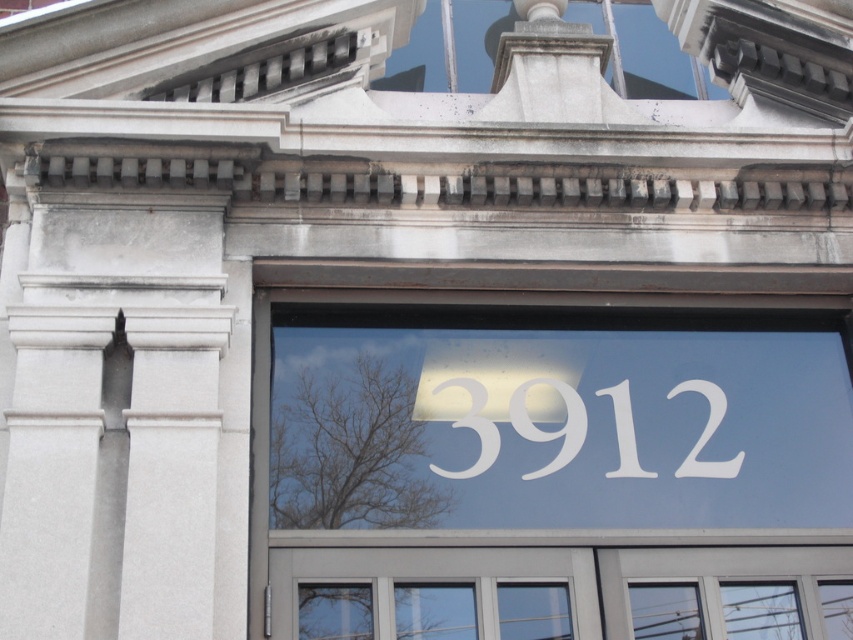
Question: Which point is farther to the camera?

Choices:
 (A) (265, 579)
 (B) (709, 474)

Answer: (B)

Question: Can you confirm if white vinyl numbers at center is positioned to the left of white matte number at center?

Choices:
 (A) yes
 (B) no

Answer: (A)

Question: Which point is closer to the camera?

Choices:
 (A) (791, 372)
 (B) (561, 403)

Answer: (B)

Question: Can you confirm if white vinyl numbers at center is thinner than white matte number at center?

Choices:
 (A) no
 (B) yes

Answer: (A)

Question: Can you confirm if white vinyl numbers at center is thinner than white matte number at center?

Choices:
 (A) yes
 (B) no

Answer: (B)

Question: Among these points, which one is nearest to the camera?

Choices:
 (A) (396, 561)
 (B) (544, 380)

Answer: (A)